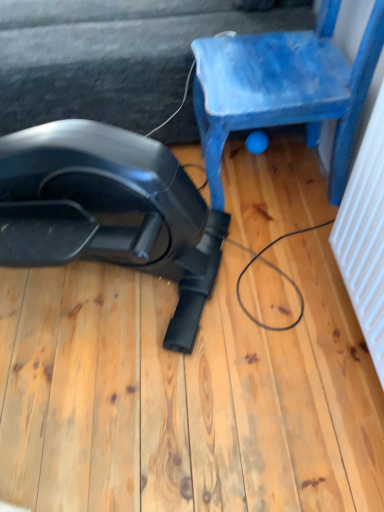
Question: Is blue painted wood chair at upper right spatially inside black rubber vacuum cleaner at lower left, or outside of it?

Choices:
 (A) outside
 (B) inside

Answer: (A)

Question: Is point (273, 68) positioned closer to the camera than point (87, 185)?

Choices:
 (A) closer
 (B) farther

Answer: (B)

Question: Which of these objects is positioned closest to the black rubber vacuum cleaner at lower left?

Choices:
 (A) blue painted wood chair at upper right
 (B) black plastic vacuum cleaner at lower left

Answer: (A)

Question: Which object is positioned farthest from the black plastic vacuum cleaner at lower left?

Choices:
 (A) blue painted wood chair at upper right
 (B) black rubber vacuum cleaner at lower left

Answer: (B)